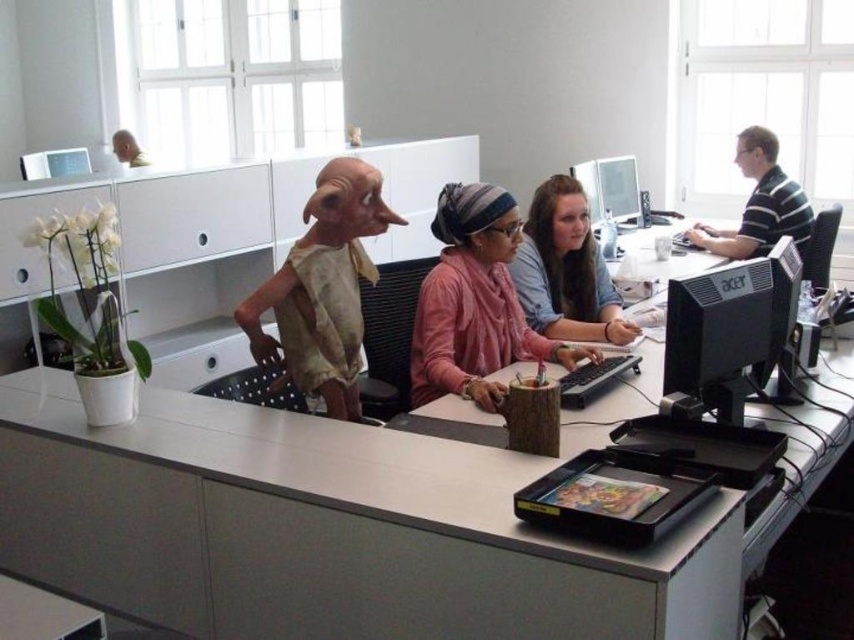
Question: Which object is the closest to the matte black monitor at upper right?

Choices:
 (A) light blue denim shirt at center
 (B) white matte head at upper center

Answer: (A)

Question: Which point is closer to the camera?

Choices:
 (A) black plastic monitor at center right
 (B) light blue denim shirt at center

Answer: (A)

Question: Is black plastic monitor at center right to the right of light blue denim shirt at center from the viewer's perspective?

Choices:
 (A) yes
 (B) no

Answer: (A)

Question: Does light blue denim shirt at center have a greater width compared to striped polo shirt at right?

Choices:
 (A) no
 (B) yes

Answer: (A)

Question: Which object is the farthest from the pink fabric at center?

Choices:
 (A) striped polo shirt at right
 (B) matte black monitor at upper right

Answer: (A)

Question: Does pink fabric at center appear on the left side of white matte head at upper center?

Choices:
 (A) no
 (B) yes

Answer: (A)